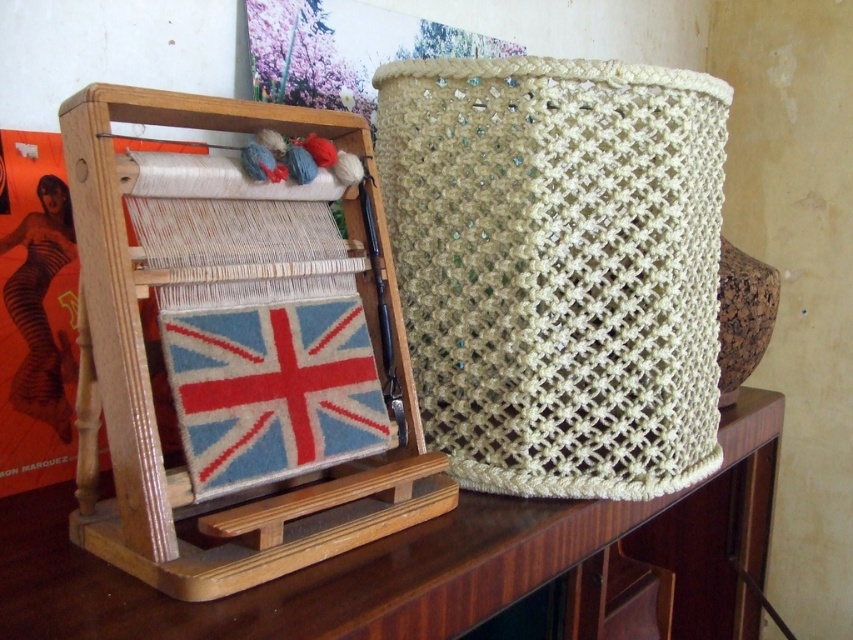
You are an artisan working on a weaving project. You have a beige woven basket at center and a woolen union jack at center in front of you. Which object would require more space to store if you need to pack them away separately?

The beige woven basket at center has a larger size compared to the woolen union jack at center, so it would require more space to store.

You are an artisan working on a weaving project. You have a wooden table at center and a woolen union jack at center. Which object takes up more space on the table?

The wooden table at center is larger in size than the woolen union jack at center, so the wooden table at center occupies more space on the table.

You are standing in front of the weaving loom and notice two points marked on the image. Which point is closer to you, point (415,570) or point (316,440)?

Point (415,570) is in front of point (316,440), so it is closer to you.